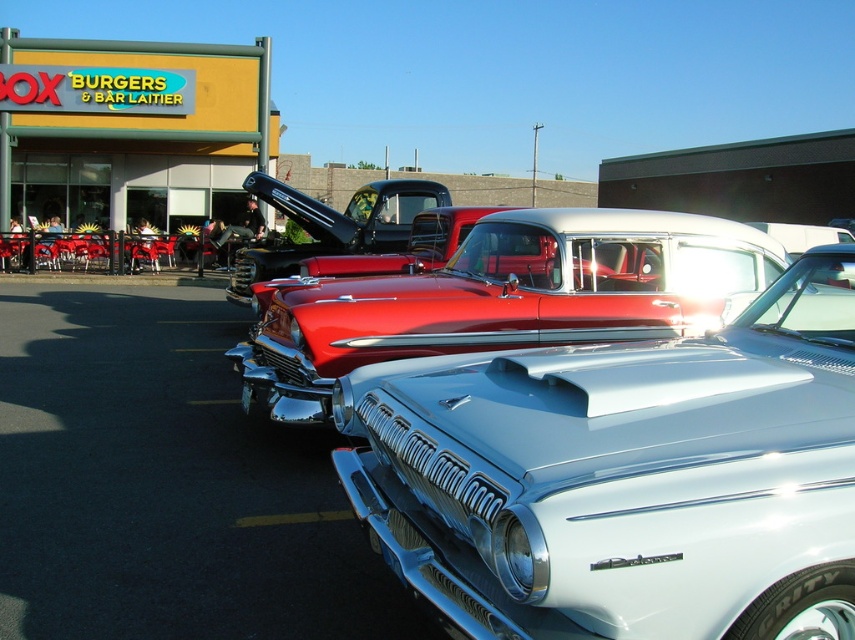
You are a delivery driver who needs to park your vehicle near the burger restaurant. You see the glossy red pickup truck at center and the yellow sign at upper left. Which object should you use as a reference point to ensure your parking spot is closest to the entrance?

The yellow sign at upper left should be used as the reference point because the glossy red pickup truck at center is positioned to its right, meaning the sign is closer to the entrance of the burger restaurant.

You are standing at the entrance of the BURGERS restaurant and want to take a photo of the metallic silver car at center. Where should you position yourself to capture it in the frame?

To capture the metallic silver car at center in your photo, position yourself at the entrance of the BURGERS restaurant and aim your camera towards the coordinates point (624,476) where the metallic silver car at center is located.